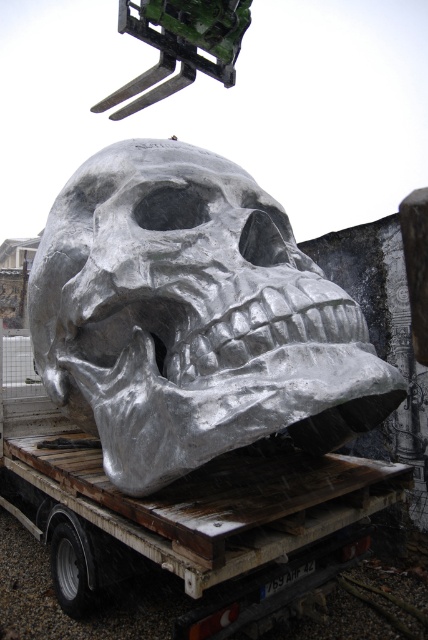
You are an art installer standing at the origin point of the image coordinate system. The trailer is at point 0.5,0.5. You need to move the shiny metallic skull at center to the trailer. Which direction should you move it?

The shiny metallic skull at center is at point (x=193, y=317), while the trailer is at (x=214, y=320). Therefore, you should move it northeast to reach the trailer.

You are an art installer trying to position a spotlight on the trailer to highlight the shiny metallic skull at center. The spotlight can only illuminate a circular area with a radius of 0.4 units. Given the coordinates of the point where the skull is located at point (193, 317), will the spotlight be able to fully illuminate the skull if placed at the center of the trailer?

The point (193, 317) indicates the shiny metallic skull at center. Since the spotlight is placed at the center of the trailer and the skull is also at the center, the distance between them is zero. The radius of the spotlight is 0.4 units, which is more than sufficient to fully illuminate the skull at point (193, 317).